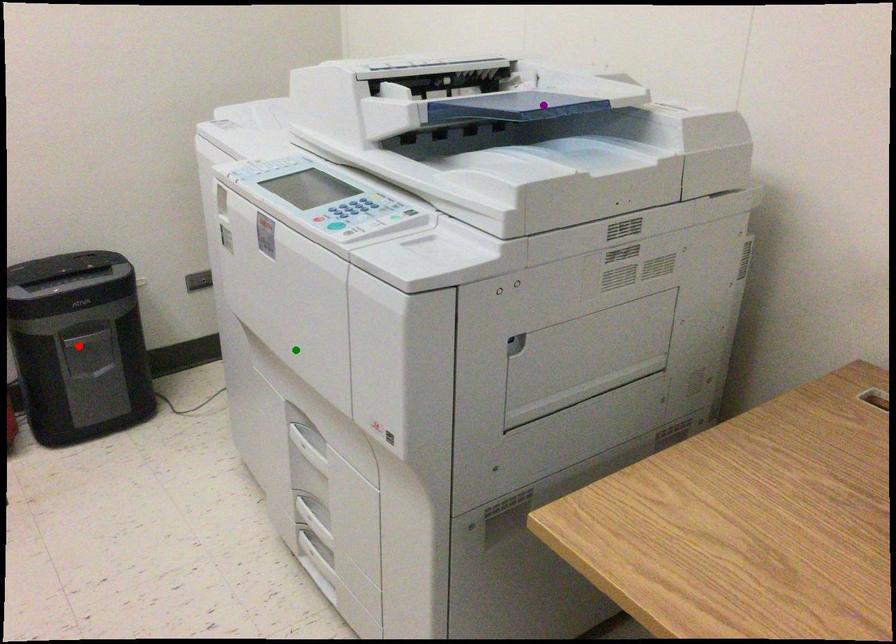
Order these from nearest to farthest:
1. red point
2. purple point
3. green point

red point < purple point < green point